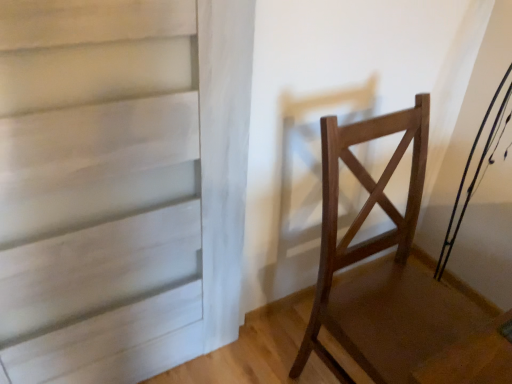
Find the location of a particular element. Image resolution: width=512 pixels, height=384 pixels. white matte door at center is located at coordinates (112, 185).

What do you see at coordinates (112, 185) in the screenshot? The height and width of the screenshot is (384, 512). I see `white matte door at center` at bounding box center [112, 185].

Where is `wooden chair at right`? This screenshot has height=384, width=512. wooden chair at right is located at coordinates (361, 209).

This screenshot has height=384, width=512. What do you see at coordinates (361, 209) in the screenshot? I see `wooden chair at right` at bounding box center [361, 209].

Image resolution: width=512 pixels, height=384 pixels. Identify the location of white matte door at center. (112, 185).

Does white matte door at center appear on the right side of wooden chair at right?

In fact, white matte door at center is to the left of wooden chair at right.

From the picture: Between white matte door at center and wooden chair at right, which one is positioned in front?

white matte door at center.

Is point (28, 28) positioned before point (332, 183)?

Yes, it is.

From the image's perspective, would you say white matte door at center is shown under wooden chair at right?

Actually, white matte door at center appears above wooden chair at right in the image.

From a real-world perspective, is white matte door at center under wooden chair at right?

No, from a real-world perspective, white matte door at center is not under wooden chair at right.

Can you confirm if white matte door at center is wider than wooden chair at right?

No, white matte door at center is not wider than wooden chair at right.

Is white matte door at center taller or shorter than wooden chair at right?

Clearly, white matte door at center is taller compared to wooden chair at right.

Does white matte door at center have a smaller size compared to wooden chair at right?

Yes, white matte door at center is smaller than wooden chair at right.

Is wooden chair at right completely or partially inside white matte door at center?

No, wooden chair at right is not a part of white matte door at center.

Is white matte door at center far away from wooden chair at right?

No, white matte door at center is not far from wooden chair at right.

Is white matte door at center oriented away from wooden chair at right?

No.

What's the angular difference between white matte door at center and wooden chair at right's facing directions?

The angular difference between white matte door at center and wooden chair at right is 1.88 degrees.

Identify the location of door that appears on the left of wooden chair at right. This screenshot has height=384, width=512. (112, 185).

Is wooden chair at right to the left of white matte door at center from the viewer's perspective?

Incorrect, wooden chair at right is not on the left side of white matte door at center.

Is wooden chair at right in front of or behind white matte door at center in the image?

Visually, wooden chair at right is located behind white matte door at center.

Which point is more forward, (318, 285) or (57, 323)?

Positioned in front is point (57, 323).

From the image's perspective, would you say wooden chair at right is positioned over white matte door at center?

No, from the image's perspective, wooden chair at right is not on top of white matte door at center.

Looking at this image, from a real-world perspective, is wooden chair at right under white matte door at center?

Yes, from a real-world perspective, wooden chair at right is below white matte door at center.

Between wooden chair at right and white matte door at center, which one has smaller width?

white matte door at center.

Considering the sizes of objects wooden chair at right and white matte door at center in the image provided, who is shorter, wooden chair at right or white matte door at center?

With less height is wooden chair at right.

Is wooden chair at right bigger or smaller than white matte door at center?

Considering their sizes, wooden chair at right takes up more space than white matte door at center.

Would you say wooden chair at right is inside or outside white matte door at center?

wooden chair at right exists outside the volume of white matte door at center.

Would you say wooden chair at right is a long distance from white matte door at center?

No, wooden chair at right is in close proximity to white matte door at center.

Does wooden chair at right turn towards white matte door at center?

No, wooden chair at right is not aimed at white matte door at center.

How many degrees apart are the facing directions of wooden chair at right and white matte door at center?

The facing directions of wooden chair at right and white matte door at center are 1.88 degrees apart.

How distant is wooden chair at right from white matte door at center?

wooden chair at right and white matte door at center are 47.52 centimeters apart from each other.

Locate an element on the screen. Image resolution: width=512 pixels, height=384 pixels. chair directly beneath the white matte door at center (from a real-world perspective) is located at coordinates (361, 209).

Image resolution: width=512 pixels, height=384 pixels. Identify the location of door located above the wooden chair at right (from a real-world perspective). [x=112, y=185].

This screenshot has height=384, width=512. I want to click on chair below the white matte door at center (from a real-world perspective), so click(361, 209).